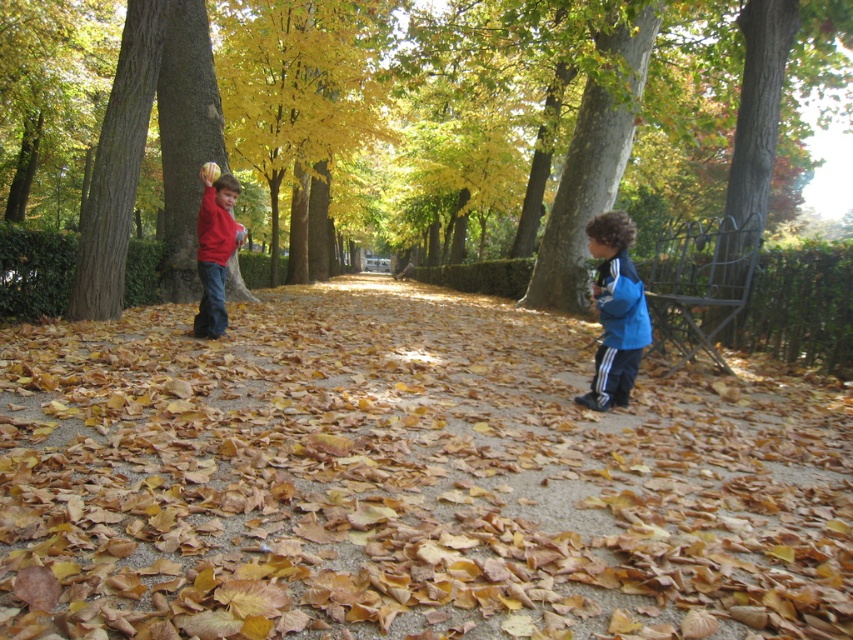
Question: Does blue fleece jacket at right appear over matte red sweater at left?

Choices:
 (A) no
 (B) yes

Answer: (A)

Question: Does blue fleece jacket at right have a lesser width compared to matte red sweater at left?

Choices:
 (A) yes
 (B) no

Answer: (A)

Question: Is blue fleece jacket at right wider than matte red sweater at left?

Choices:
 (A) yes
 (B) no

Answer: (B)

Question: Which point is farther to the camera?

Choices:
 (A) matte red sweater at left
 (B) blue fleece jacket at right

Answer: (A)

Question: Which of the following is the farthest from the observer?

Choices:
 (A) [x=213, y=200]
 (B) [x=612, y=388]

Answer: (A)